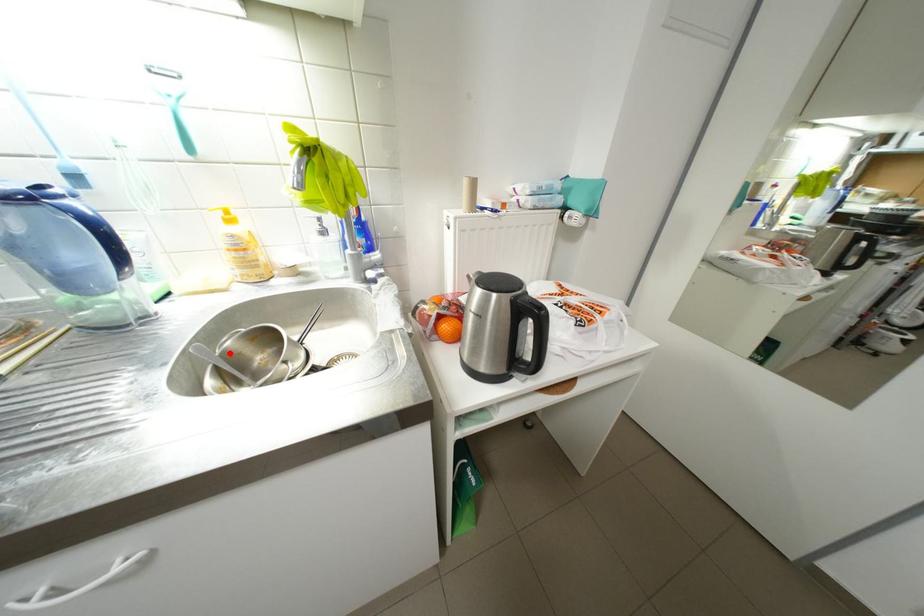
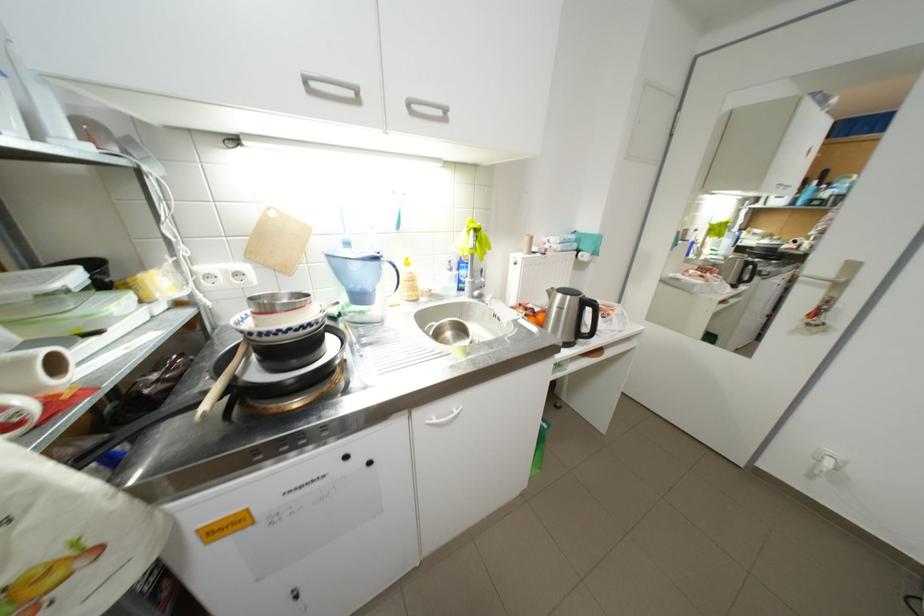
The point at the highlighted location is marked in the first image. Where is the corresponding point in the second image?

(443, 334)